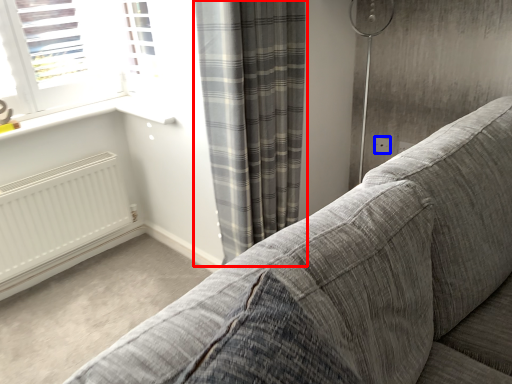
Question: Which of the following is the closest to the observer, curtain (highlighted by a red box) or electric outlet (highlighted by a blue box)?

Choices:
 (A) curtain
 (B) electric outlet

Answer: (A)